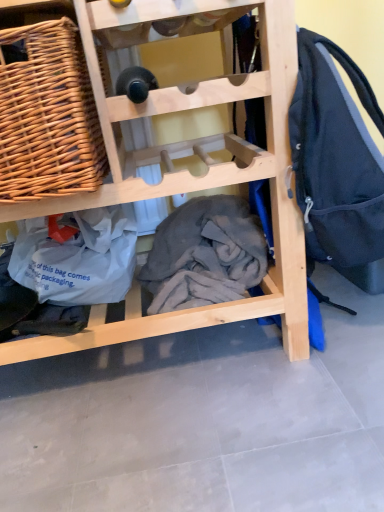
Identify the location of woven wood picnic basket at upper left. The width and height of the screenshot is (384, 512). (47, 115).

Where is `natural wood wine rack at center`? This screenshot has height=512, width=384. natural wood wine rack at center is located at coordinates (192, 175).

Can you tell me how much woven wood picnic basket at upper left and natural wood wine rack at center differ in facing direction?

The facing directions of woven wood picnic basket at upper left and natural wood wine rack at center are 0.000742 degrees apart.

Does point (21, 70) appear closer or farther from the camera than point (134, 282)?

Point (21, 70) appears to be closer to the viewer than point (134, 282).

Does woven wood picnic basket at upper left have a greater height compared to natural wood wine rack at center?

Incorrect, the height of woven wood picnic basket at upper left is not larger of that of natural wood wine rack at center.

Is woven wood picnic basket at upper left oriented towards natural wood wine rack at center?

Yes, woven wood picnic basket at upper left faces towards natural wood wine rack at center.

How many degrees apart are the facing directions of natural wood wine rack at center and gray cotton blanket at center?

0.000842 degrees.

From a real-world perspective, is natural wood wine rack at center on top of gray cotton blanket at center?

Yes, from a real-world perspective, natural wood wine rack at center is above gray cotton blanket at center.

In the scene shown: Would you consider natural wood wine rack at center to be distant from gray cotton blanket at center?

No, natural wood wine rack at center is not far away from gray cotton blanket at center.

Consider the image. Between natural wood wine rack at center and gray cotton blanket at center, which one has smaller size?

Smaller between the two is gray cotton blanket at center.

Is woven wood picnic basket at upper left not within gray cotton blanket at center?

Yes, woven wood picnic basket at upper left is located beyond the bounds of gray cotton blanket at center.

Does woven wood picnic basket at upper left appear on the right side of gray cotton blanket at center?

No.

Which is in front, point (72, 153) or point (194, 229)?

Point (72, 153)

From the image's perspective, which is above, woven wood picnic basket at upper left or gray cotton blanket at center?

woven wood picnic basket at upper left.

Is gray cotton blanket at center oriented towards natural wood wine rack at center?

Yes, gray cotton blanket at center faces towards natural wood wine rack at center.

Is gray cotton blanket at center wider or thinner than natural wood wine rack at center?

In the image, gray cotton blanket at center appears to be more narrow than natural wood wine rack at center.

Locate an element on the screen. clothing located underneath the natural wood wine rack at center (from a real-world perspective) is located at coordinates (205, 253).

From a real-world perspective, between gray cotton blanket at center and natural wood wine rack at center, who is vertically lower?

gray cotton blanket at center.

Which object is thinner, natural wood wine rack at center or woven wood picnic basket at upper left?

Thinner between the two is woven wood picnic basket at upper left.

Which is in front, point (252, 151) or point (22, 53)?

The point (22, 53) is closer.

Who is shorter, natural wood wine rack at center or woven wood picnic basket at upper left?

With less height is woven wood picnic basket at upper left.

What's the angular difference between natural wood wine rack at center and woven wood picnic basket at upper left's facing directions?

0.000742 degrees separate the facing orientations of natural wood wine rack at center and woven wood picnic basket at upper left.

Does gray cotton blanket at center have a lesser width compared to woven wood picnic basket at upper left?

Yes, gray cotton blanket at center is thinner than woven wood picnic basket at upper left.

Is point (163, 297) farther from viewer compared to point (23, 52)?

Yes, it is behind point (23, 52).

Is the position of gray cotton blanket at center less distant than that of woven wood picnic basket at upper left?

No, it is not.

Is gray cotton blanket at center aimed at woven wood picnic basket at upper left?

No, gray cotton blanket at center is not facing towards woven wood picnic basket at upper left.

Locate an element on the screen. picnic basket above the natural wood wine rack at center (from a real-world perspective) is located at coordinates (47, 115).

This screenshot has width=384, height=512. In order to click on furniture located on the left of gray cotton blanket at center in this screenshot , I will do `click(192, 175)`.

Based on their spatial positions, is gray cotton blanket at center or woven wood picnic basket at upper left further from natural wood wine rack at center?

woven wood picnic basket at upper left is positioned further to the anchor natural wood wine rack at center.

Based on their spatial positions, is woven wood picnic basket at upper left or gray cotton blanket at center closer to natural wood wine rack at center?

Based on the image, gray cotton blanket at center appears to be nearer to natural wood wine rack at center.

From the image, which object appears to be farther from gray cotton blanket at center, woven wood picnic basket at upper left or natural wood wine rack at center?

woven wood picnic basket at upper left is further to gray cotton blanket at center.

Considering their positions, is gray cotton blanket at center positioned further to woven wood picnic basket at upper left than natural wood wine rack at center?

gray cotton blanket at center is further to woven wood picnic basket at upper left.

Which object lies nearer to the anchor point gray cotton blanket at center, natural wood wine rack at center or woven wood picnic basket at upper left?

Among the two, natural wood wine rack at center is located nearer to gray cotton blanket at center.

From the image, which object appears to be nearer to woven wood picnic basket at upper left, natural wood wine rack at center or gray cotton blanket at center?

natural wood wine rack at center.

Where is `picnic basket between natural wood wine rack at center and gray cotton blanket at center from front to back`? The width and height of the screenshot is (384, 512). picnic basket between natural wood wine rack at center and gray cotton blanket at center from front to back is located at coordinates (47, 115).